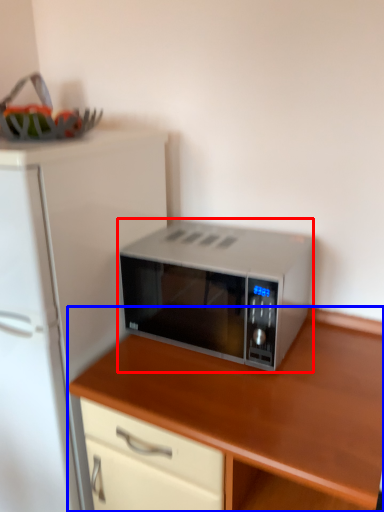
Question: Which object appears farthest to the camera in this image, microwave oven (highlighted by a red box) or cabinetry (highlighted by a blue box)?

Choices:
 (A) microwave oven
 (B) cabinetry

Answer: (A)